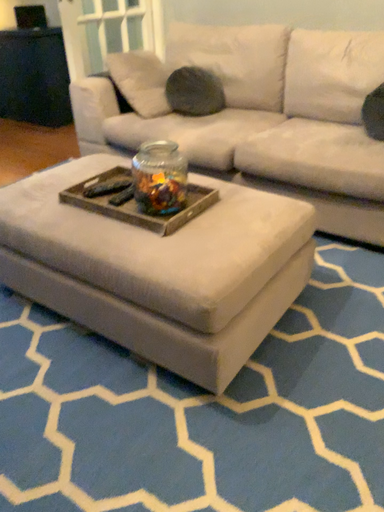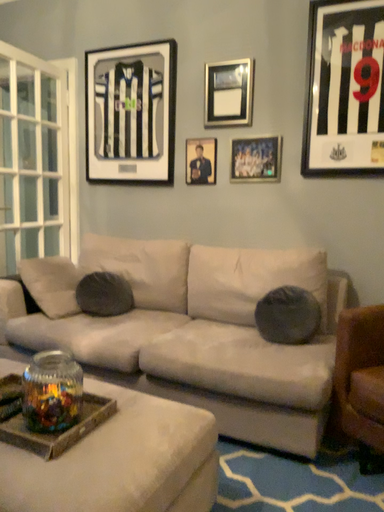
Question: How did the camera likely rotate when shooting the video?

Choices:
 (A) rotated left
 (B) rotated right

Answer: (B)